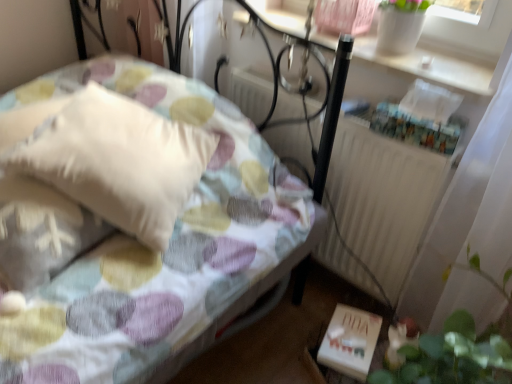
Question: Is fluffy white pillow at upper left facing towards white textured radiator at center?

Choices:
 (A) no
 (B) yes

Answer: (A)

Question: Is fluffy white pillow at upper left directly adjacent to white textured radiator at center?

Choices:
 (A) no
 (B) yes

Answer: (A)

Question: From the image's perspective, is fluffy white pillow at upper left located beneath white textured radiator at center?

Choices:
 (A) yes
 (B) no

Answer: (B)

Question: Does fluffy white pillow at upper left have a lesser height compared to white textured radiator at center?

Choices:
 (A) yes
 (B) no

Answer: (B)

Question: Considering the relative positions of fluffy white pillow at upper left and white textured radiator at center in the image provided, is fluffy white pillow at upper left behind white textured radiator at center?

Choices:
 (A) no
 (B) yes

Answer: (A)

Question: Is fluffy white pillow at upper left wider than white textured radiator at center?

Choices:
 (A) yes
 (B) no

Answer: (A)

Question: Is green leafy plant at lower right positioned far away from white matte book at lower right?

Choices:
 (A) yes
 (B) no

Answer: (B)

Question: Is green leafy plant at lower right positioned with its back to white matte book at lower right?

Choices:
 (A) no
 (B) yes

Answer: (A)

Question: Does green leafy plant at lower right have a greater height compared to white matte book at lower right?

Choices:
 (A) yes
 (B) no

Answer: (A)

Question: From a real-world perspective, is green leafy plant at lower right physically above white matte book at lower right?

Choices:
 (A) no
 (B) yes

Answer: (B)

Question: Does green leafy plant at lower right appear on the left side of white matte book at lower right?

Choices:
 (A) no
 (B) yes

Answer: (A)

Question: Is green leafy plant at lower right thinner than white matte book at lower right?

Choices:
 (A) no
 (B) yes

Answer: (A)

Question: Is white matte book at lower right at the right side of white textured radiator at center?

Choices:
 (A) yes
 (B) no

Answer: (A)